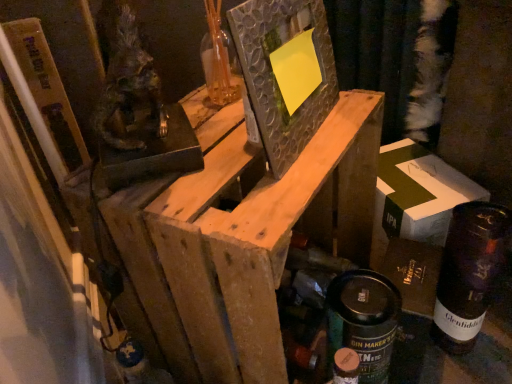
Question: Is wooden frame at center located within white cardboard box at right?

Choices:
 (A) no
 (B) yes

Answer: (A)

Question: Can you confirm if white cardboard box at right is positioned to the right of wooden frame at center?

Choices:
 (A) yes
 (B) no

Answer: (A)

Question: Is white cardboard box at right positioned with its back to wooden frame at center?

Choices:
 (A) yes
 (B) no

Answer: (B)

Question: From the image's perspective, would you say white cardboard box at right is positioned over wooden frame at center?

Choices:
 (A) no
 (B) yes

Answer: (B)

Question: Considering the relative sizes of white cardboard box at right and wooden frame at center in the image provided, is white cardboard box at right bigger than wooden frame at center?

Choices:
 (A) no
 (B) yes

Answer: (A)

Question: Considering the relative sizes of white cardboard box at right and wooden frame at center in the image provided, is white cardboard box at right taller than wooden frame at center?

Choices:
 (A) yes
 (B) no

Answer: (B)

Question: Does white cardboard box at right come in front of dark glass bottle at lower right?

Choices:
 (A) yes
 (B) no

Answer: (B)

Question: Can you confirm if white cardboard box at right is positioned to the left of dark glass bottle at lower right?

Choices:
 (A) yes
 (B) no

Answer: (A)

Question: Is white cardboard box at right surrounding dark glass bottle at lower right?

Choices:
 (A) no
 (B) yes

Answer: (A)

Question: From the image's perspective, does white cardboard box at right appear higher than dark glass bottle at lower right?

Choices:
 (A) no
 (B) yes

Answer: (B)

Question: Is white cardboard box at right at the right side of dark glass bottle at lower right?

Choices:
 (A) no
 (B) yes

Answer: (A)

Question: Does white cardboard box at right have a lesser width compared to dark glass bottle at lower right?

Choices:
 (A) no
 (B) yes

Answer: (A)

Question: Could you tell me if matte black spray can at lower right is turned towards textured glass picture frame at center?

Choices:
 (A) yes
 (B) no

Answer: (B)